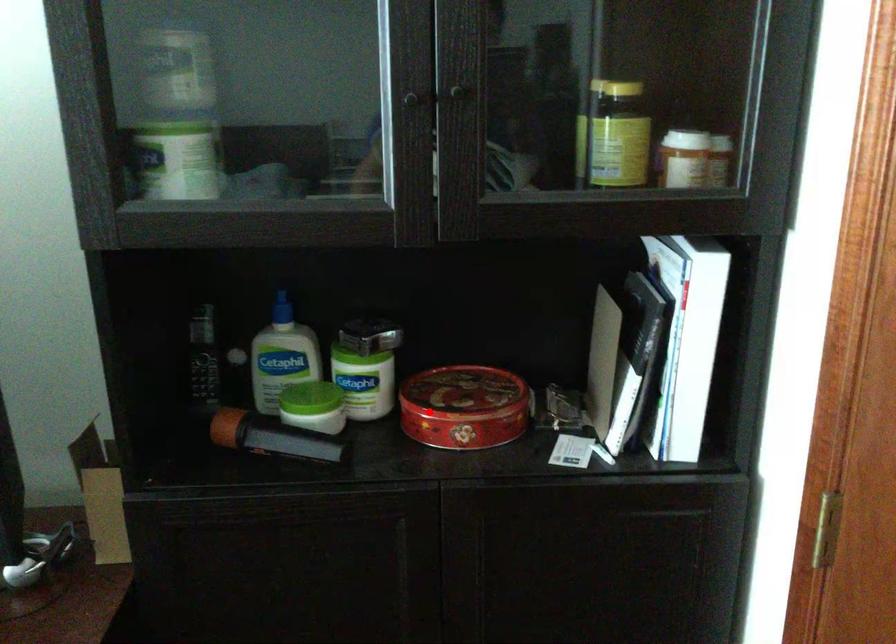
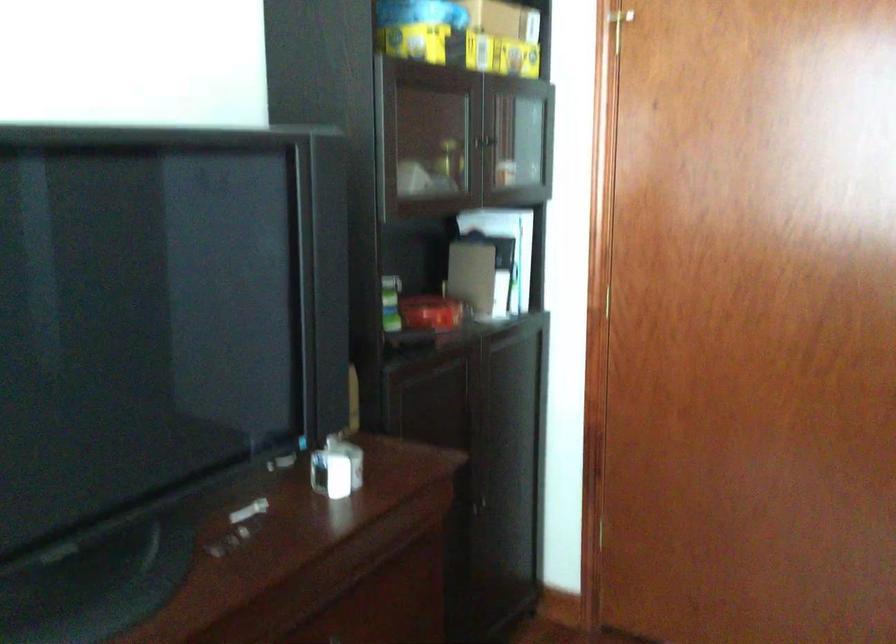
Question: I am providing you with two images of the same scene from different viewpoints. In image1, a red point is highlighted. Considering the same 3D point in image2, which of the following is correct?

Choices:
 (A) It is closer
 (B) It is farther

Answer: (B)